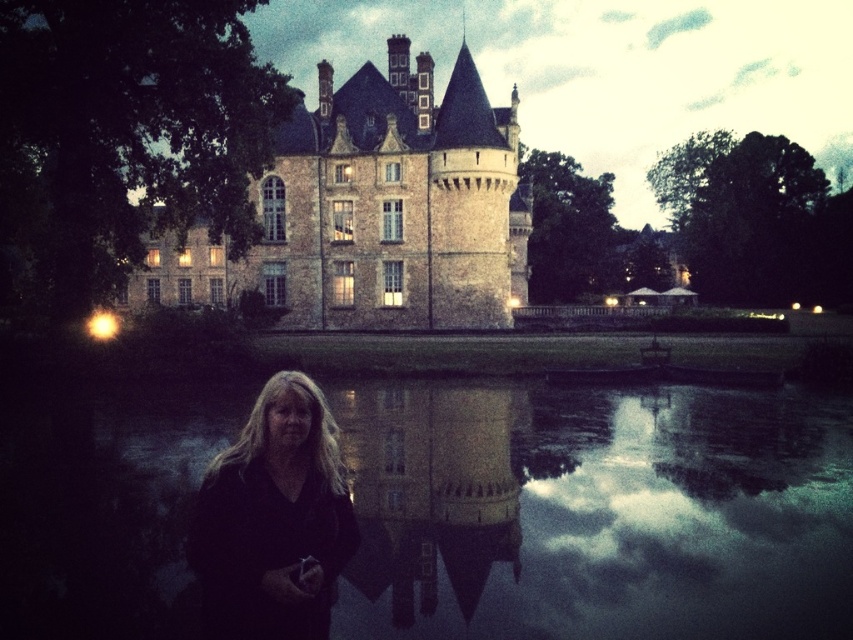
You are a visitor at the brown stone castle at upper center and want to take a photo of the black matte hair at center. Since the castle is in the way, can you still take the photo without moving the person?

The brown stone castle at upper center is positioned over black matte hair at center, so the castle would block the view of the black matte hair at center. You would need to move either yourself or the person to take the photo without obstruction.

You are standing at the water edge and want to take a photo of the brown stone castle at upper center. According to its 2D location coordinates, where should you aim your camera to capture the castle in the frame?

To capture the brown stone castle at upper center in the frame, aim your camera at the coordinates point [372,211] as specified by its 2D location.

You are an architect analyzing the symmetry of the brown stone castle at upper center in the image. Based on the coordinates provided, can you determine if the castle is centered horizontally in the image?

The brown stone castle at upper center is located at coordinates point (372, 211). Since the horizontal coordinate is 0.330, which is less than 0.5, the castle is not perfectly centered horizontally in the image.